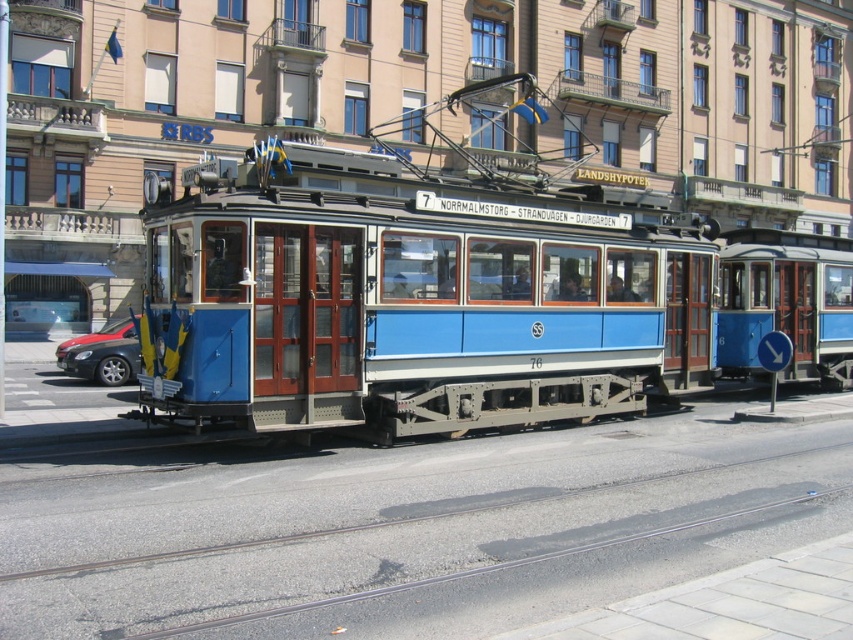
You are standing at the front of the tram and want to walk to the back. Which point, point (144, 186) or point (99, 371), is closer to your current position?

Point (99, 371) is closer to your current position because it is in front of point (144, 186).

Consider the image. You are a city planner analyzing the layout of the tram route. The tram is positioned at coordinates 0.477, 0.492. What is the exact position of the blue polished wood tram at center?

The blue polished wood tram at center is exactly at point (419, 305).